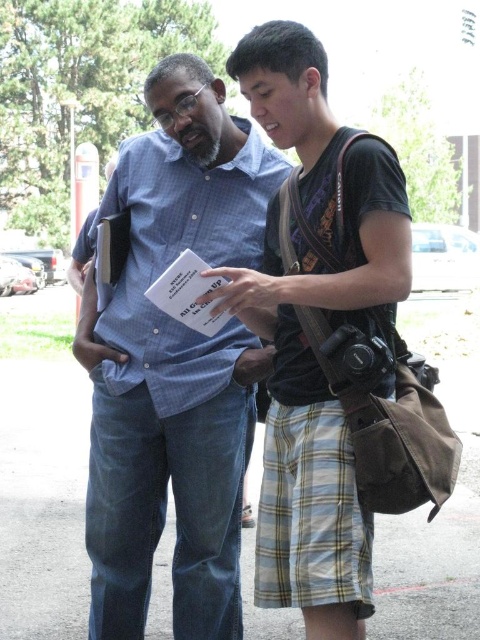
Is blue checkered shirt at center further to camera compared to plaid cotton shorts at center?

Yes, it is behind plaid cotton shorts at center.

What do you see at coordinates (175, 364) in the screenshot?
I see `blue checkered shirt at center` at bounding box center [175, 364].

Find the location of `blue checkered shirt at center`. blue checkered shirt at center is located at coordinates (175, 364).